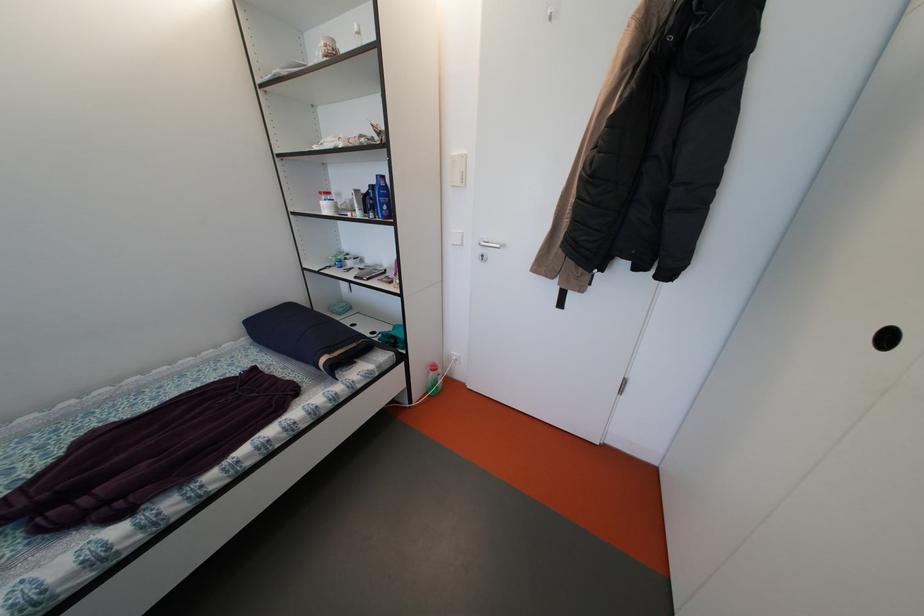
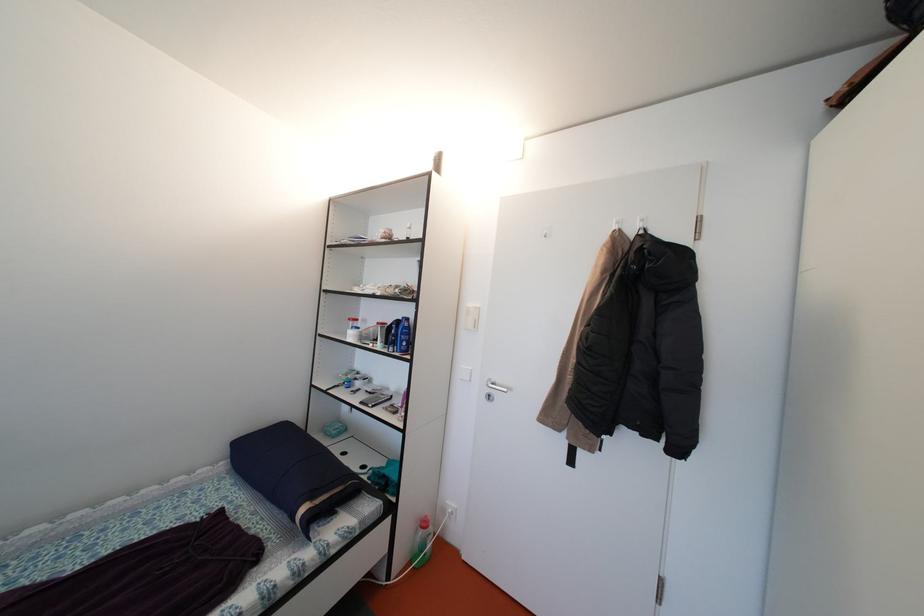
The images are taken continuously from a first-person perspective. In which direction are you moving?

The movement direction of the cameraman is left, backward.